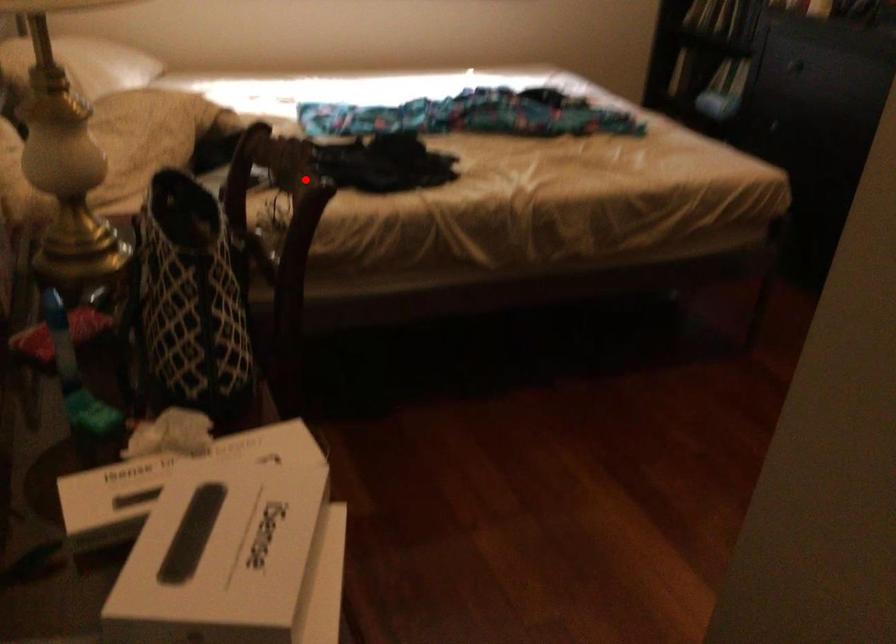
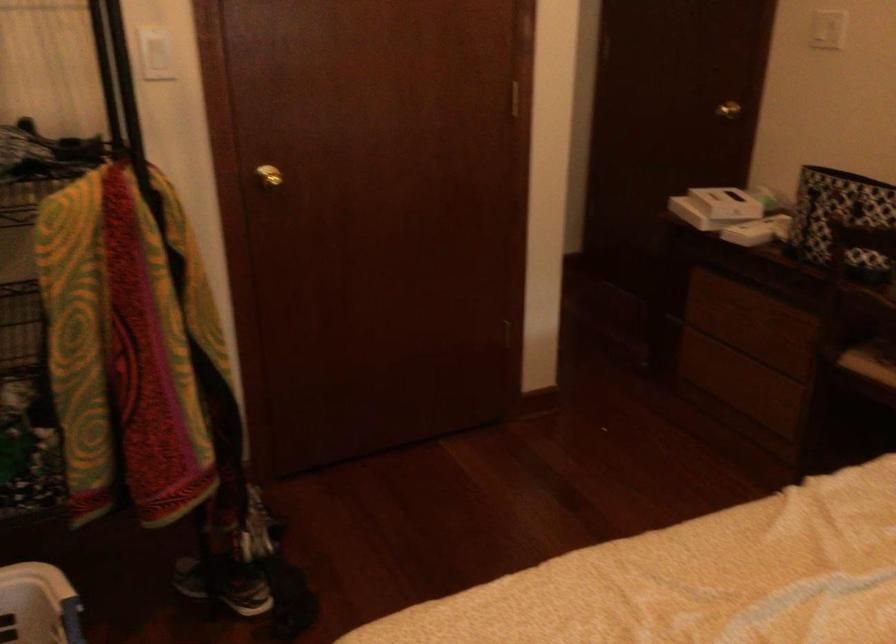
Find the pixel in the second image that matches the highlighted location in the first image.

(840, 218)